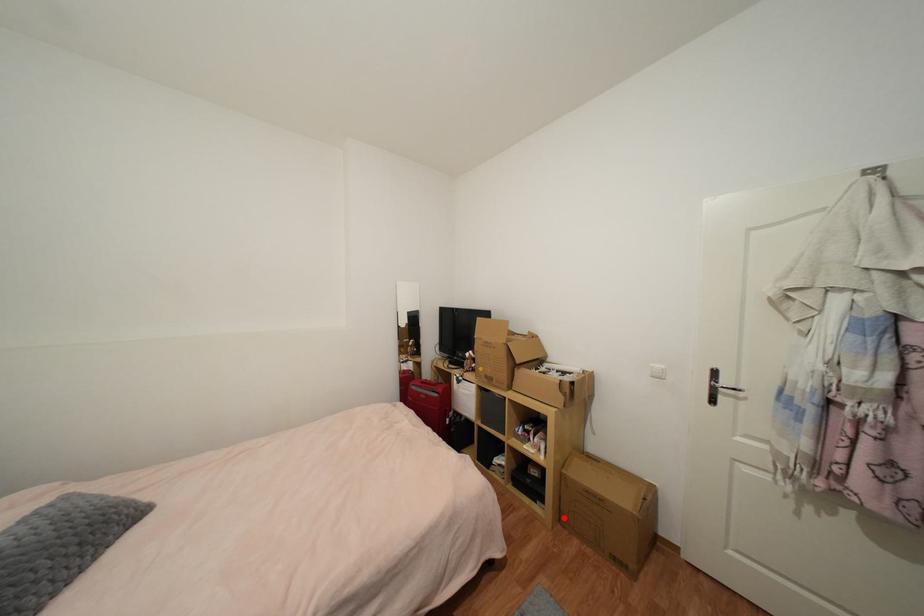
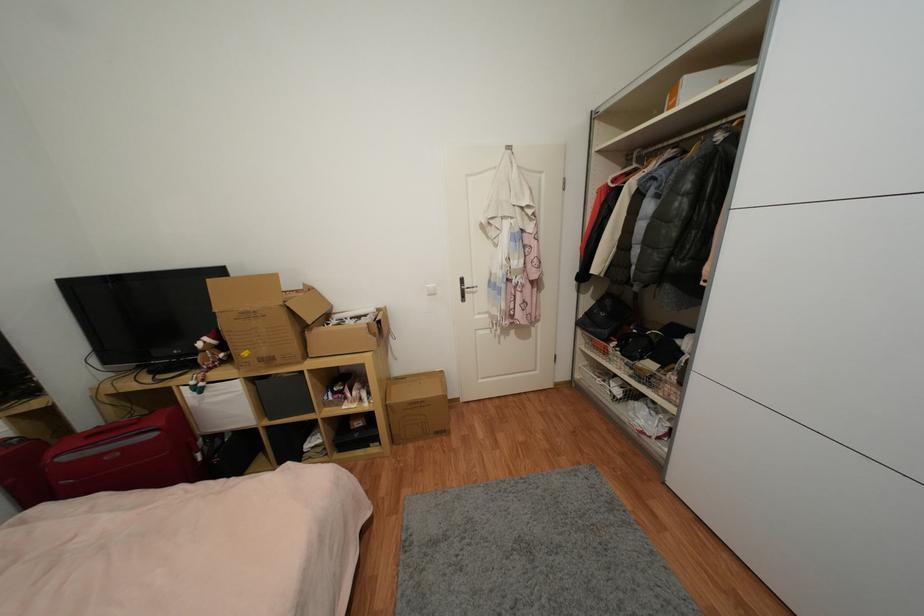
Question: I am providing you with two images of the same scene from different viewpoints. Given a red point in image1, look at the same physical point in image2. Is it:

Choices:
 (A) Closer to the viewpoint
 (B) Farther from the viewpoint

Answer: (B)